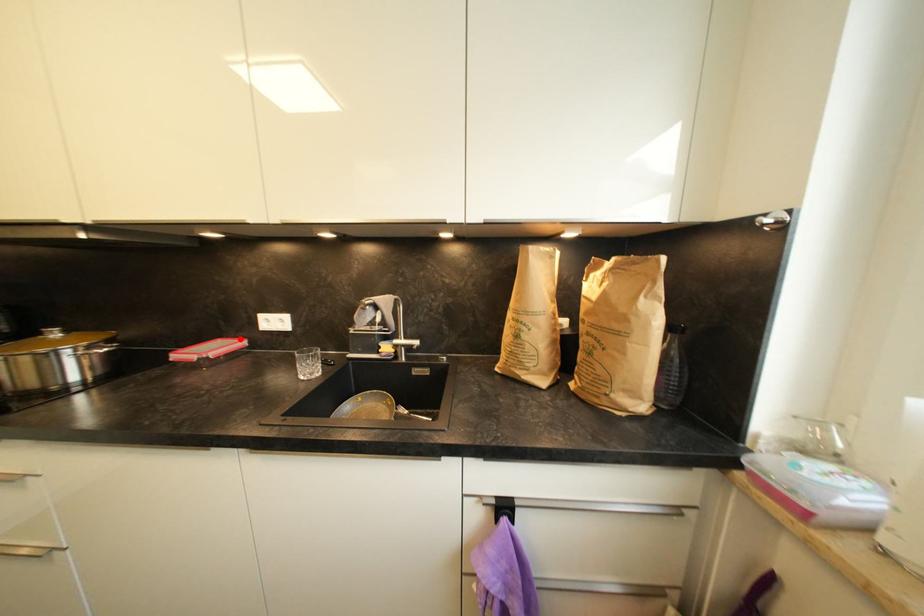
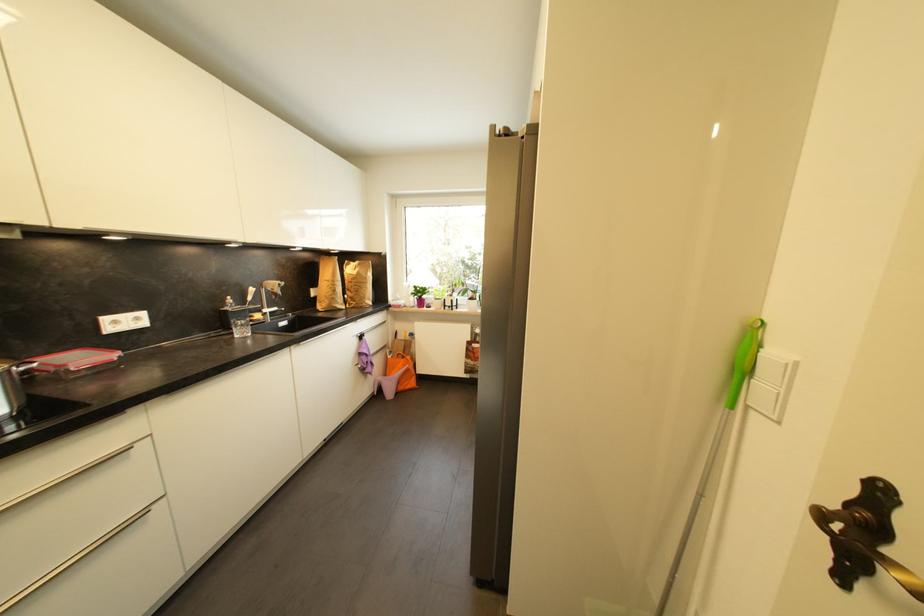
Where in the second image is the point corresponding to the highlighted location from the first image?

(54, 355)